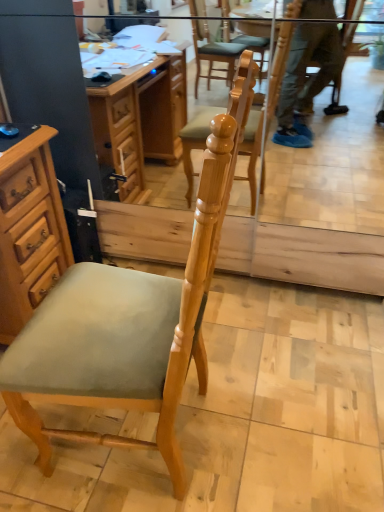
Locate an element on the screen. This screenshot has width=384, height=512. light brown wood chair at center is located at coordinates (121, 333).

The height and width of the screenshot is (512, 384). What do you see at coordinates (121, 333) in the screenshot? I see `light brown wood chair at center` at bounding box center [121, 333].

Find the location of `wooden cabinet at left`. wooden cabinet at left is located at coordinates (29, 230).

The width and height of the screenshot is (384, 512). Describe the element at coordinates (29, 230) in the screenshot. I see `wooden cabinet at left` at that location.

The width and height of the screenshot is (384, 512). Identify the location of light brown wood chair at center. (121, 333).

Does light brown wood chair at center appear on the left side of wooden cabinet at left?

No, light brown wood chair at center is not to the left of wooden cabinet at left.

Is the position of light brown wood chair at center more distant than that of wooden cabinet at left?

That is False.

Does point (166, 443) come behind point (65, 247)?

No, it is in front of (65, 247).

From the image's perspective, which one is positioned lower, light brown wood chair at center or wooden cabinet at left?

light brown wood chair at center is shown below in the image.

From a real-world perspective, is light brown wood chair at center on top of wooden cabinet at left?

Yes.

Based on the photo, does light brown wood chair at center have a greater width compared to wooden cabinet at left?

Yes.

In terms of height, does light brown wood chair at center look taller or shorter compared to wooden cabinet at left?

light brown wood chair at center is taller than wooden cabinet at left.

Between light brown wood chair at center and wooden cabinet at left, which one has smaller size?

wooden cabinet at left is smaller.

Is light brown wood chair at center located outside wooden cabinet at left?

Indeed, light brown wood chair at center is completely outside wooden cabinet at left.

In the scene shown: Is light brown wood chair at center not close to wooden cabinet at left?

No, light brown wood chair at center is in close proximity to wooden cabinet at left.

Does light brown wood chair at center turn towards wooden cabinet at left?

Yes.

I want to click on chair above the wooden cabinet at left (from a real-world perspective), so (121, 333).

Is wooden cabinet at left at the left side of light brown wood chair at center?

Correct, you'll find wooden cabinet at left to the left of light brown wood chair at center.

Considering the positions of objects wooden cabinet at left and light brown wood chair at center in the image provided, who is in front, wooden cabinet at left or light brown wood chair at center?

light brown wood chair at center is in front.

Does point (17, 173) lie in front of point (74, 292)?

No.

From the image's perspective, does wooden cabinet at left appear higher than light brown wood chair at center?

Indeed, from the image's perspective, wooden cabinet at left is shown above light brown wood chair at center.

From a real-world perspective, between wooden cabinet at left and light brown wood chair at center, who is vertically lower?

From a 3D spatial view, wooden cabinet at left is below.

Consider the image. Between wooden cabinet at left and light brown wood chair at center, which one has smaller width?

With smaller width is wooden cabinet at left.

Between wooden cabinet at left and light brown wood chair at center, which one has more height?

light brown wood chair at center.

Between wooden cabinet at left and light brown wood chair at center, which one has smaller size?

wooden cabinet at left is smaller.

Can we say wooden cabinet at left lies outside light brown wood chair at center?

Yes, wooden cabinet at left is located beyond the bounds of light brown wood chair at center.

Is the surface of wooden cabinet at left in direct contact with light brown wood chair at center?

No, wooden cabinet at left is not with light brown wood chair at center.

Is light brown wood chair at center at the back of wooden cabinet at left?

No, light brown wood chair at center is not at the back of wooden cabinet at left.

At what (x,y) coordinates should I click in order to perform the action: click on cabinetry that appears behind the light brown wood chair at center. Please return your answer as a coordinate pair (x, y). The width and height of the screenshot is (384, 512). Looking at the image, I should click on (29, 230).

I want to click on chair above the wooden cabinet at left (from a real-world perspective), so coord(121,333).

In order to click on cabinetry on the left of light brown wood chair at center in this screenshot , I will do click(x=29, y=230).